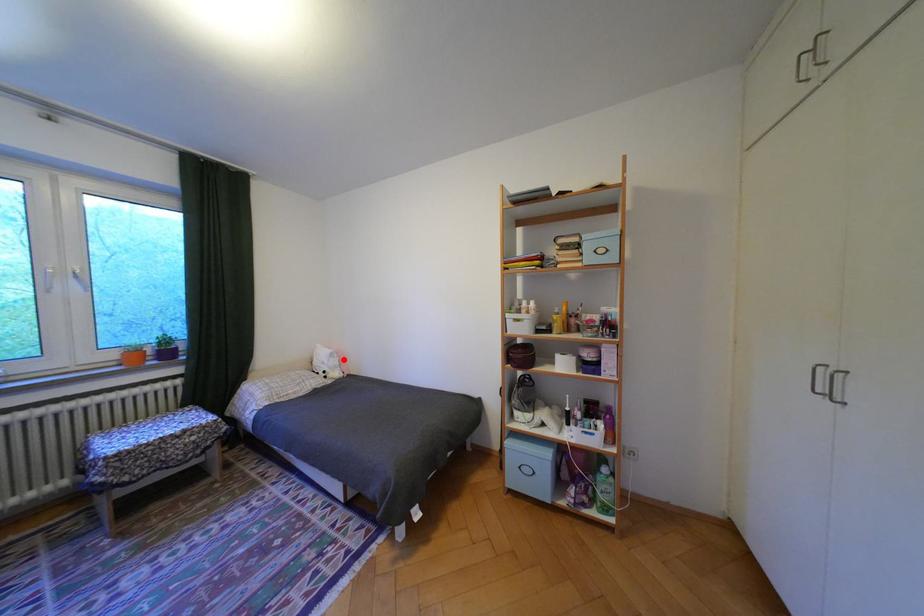
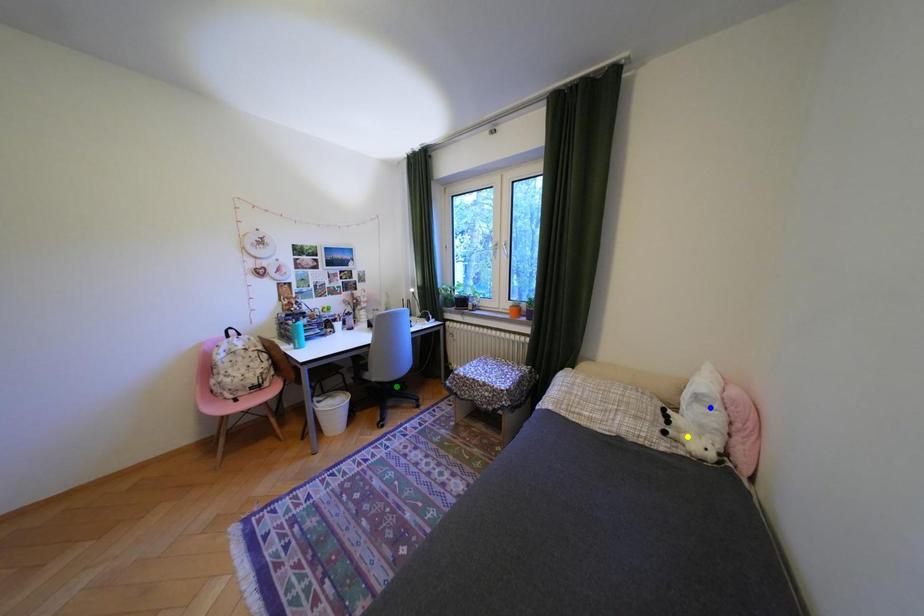
Question: I am providing you with two images of the same scene from different viewpoints. A red point is marked on the first image. You are given multiple points on the second image. Which point in image 2 is actually the same real-world point as the red point in image 1?

Choices:
 (A) yellow point
 (B) green point
 (C) blue point

Answer: (C)